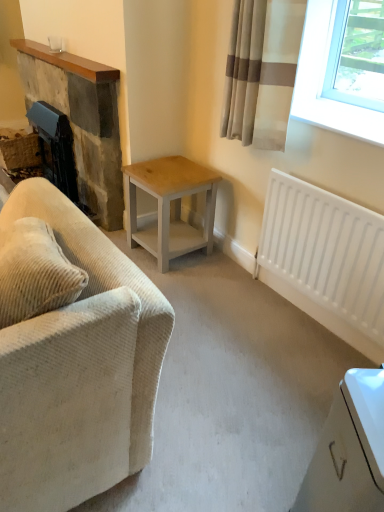
Where is `free space that is to the left of white matte radiator at lower right`? This screenshot has width=384, height=512. free space that is to the left of white matte radiator at lower right is located at coordinates (243, 322).